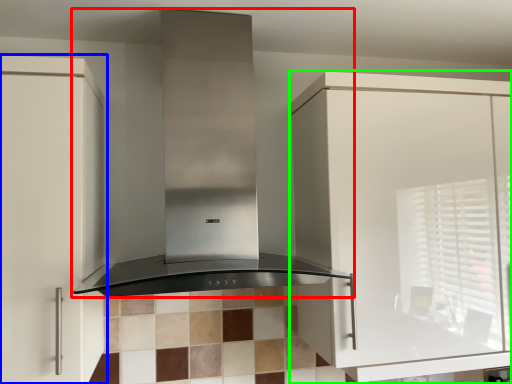
Question: Considering the real-world distances, which object is farthest from home appliance (highlighted by a red box)? cabinetry (highlighted by a blue box) or cabinetry (highlighted by a green box)?

Choices:
 (A) cabinetry
 (B) cabinetry

Answer: (B)